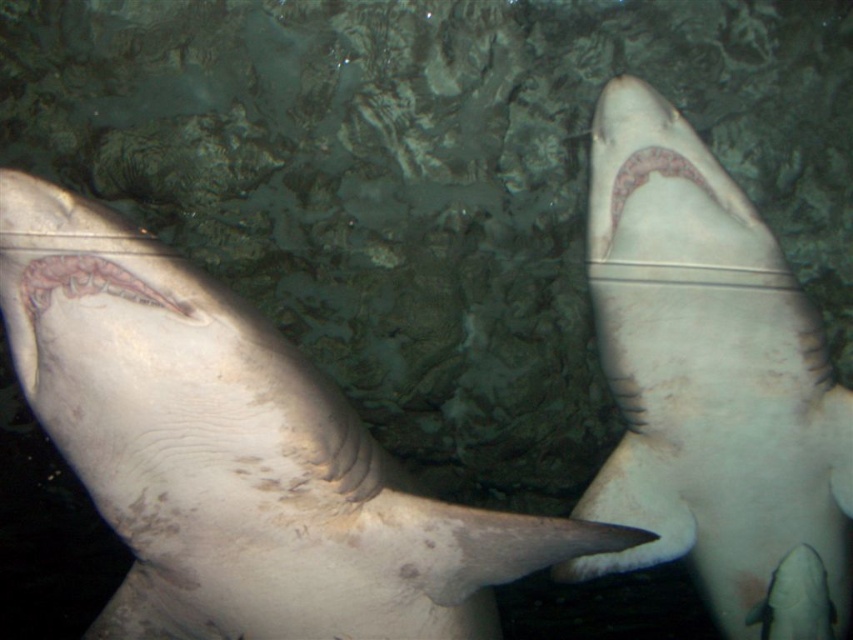
Which of these two, smooth gray shark at center or smooth white shark at upper right, stands shorter?

Standing shorter between the two is smooth gray shark at center.

Is smooth gray shark at center smaller than smooth white shark at upper right?

Indeed, smooth gray shark at center has a smaller size compared to smooth white shark at upper right.

Which is in front, point (467, 525) or point (730, 429)?

Positioned in front is point (467, 525).

Image resolution: width=853 pixels, height=640 pixels. I want to click on smooth gray shark at center, so click(242, 461).

Which is more to the right, pink translucent mouth at center or pinkish-white textured gums at upper center?

pinkish-white textured gums at upper center is more to the right.

Which is behind, point (125, 284) or point (610, 195)?

Positioned behind is point (610, 195).

Locate an element on the screen. This screenshot has width=853, height=640. pink translucent mouth at center is located at coordinates (86, 282).

Can you confirm if smooth white shark at upper right is positioned above pink translucent mouth at center?

No, smooth white shark at upper right is not above pink translucent mouth at center.

Is smooth white shark at upper right taller than pink translucent mouth at center?

Indeed, smooth white shark at upper right has a greater height compared to pink translucent mouth at center.

Identify the location of smooth white shark at upper right. This screenshot has width=853, height=640. (706, 372).